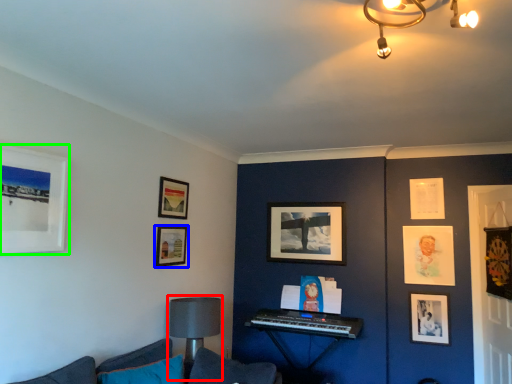
Question: Which object is the farthest from table lamp (highlighted by a red box)? Choose among these: picture frame (highlighted by a blue box) or picture frame (highlighted by a green box).

Choices:
 (A) picture frame
 (B) picture frame

Answer: (B)